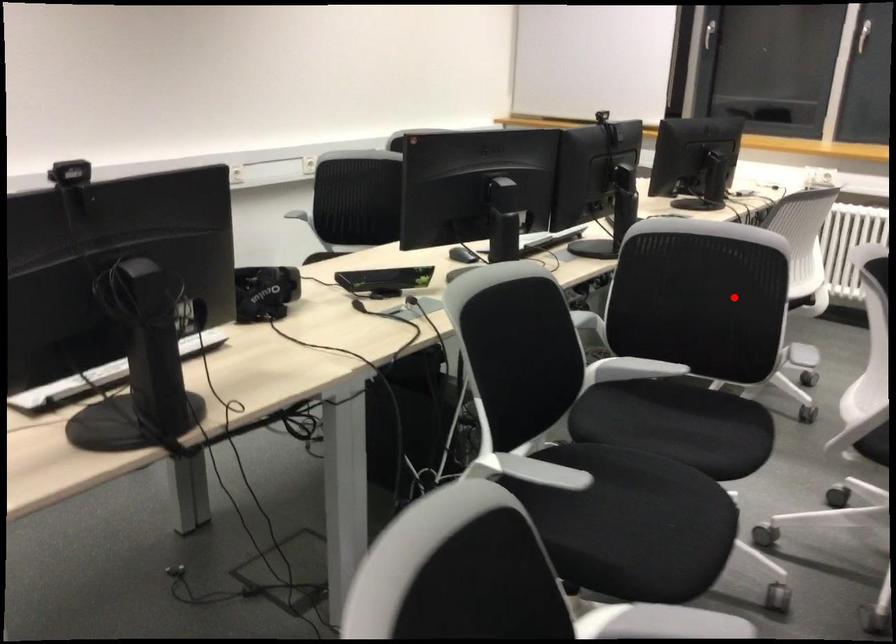
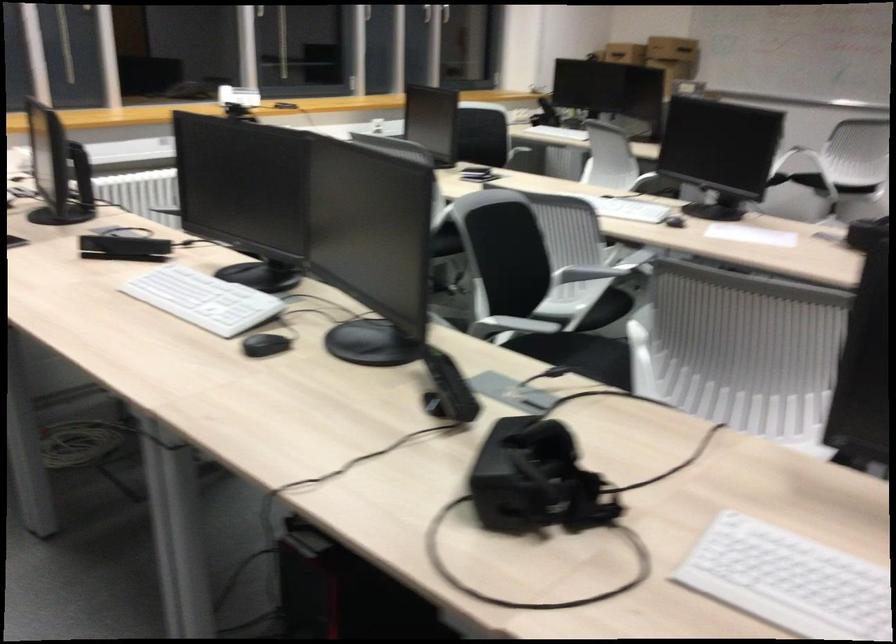
The point at the highlighted location is marked in the first image. Where is the corresponding point in the second image?

(510, 257)